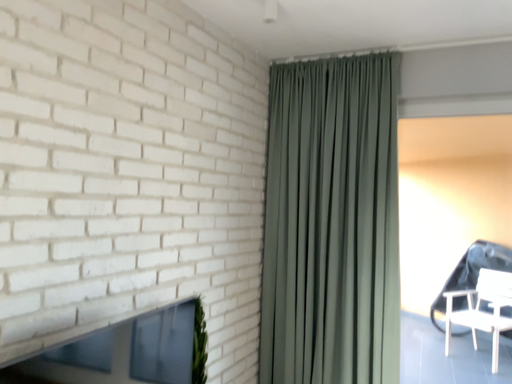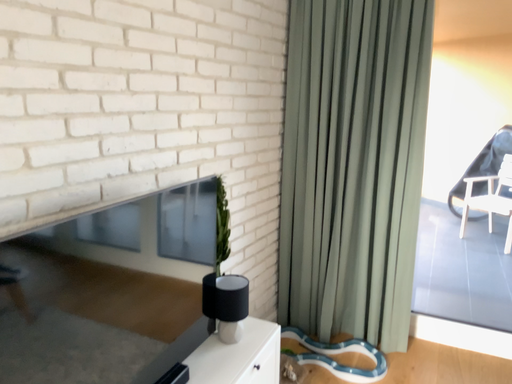
Question: Which way did the camera rotate in the video?

Choices:
 (A) rotated upward
 (B) rotated downward

Answer: (B)